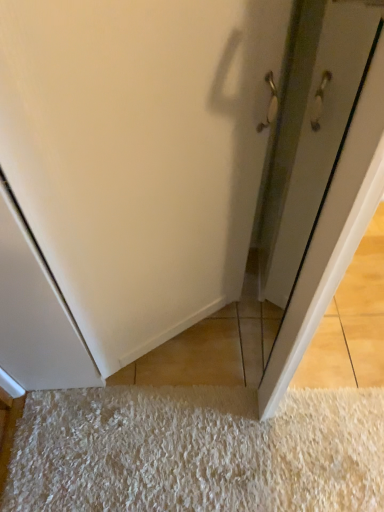
Question: Should I look upward or downward to see white glossy door at center?

Choices:
 (A) up
 (B) down

Answer: (A)

Question: Are white glossy door at center and white shaggy rug at lower center beside each other?

Choices:
 (A) yes
 (B) no

Answer: (B)

Question: Is white glossy door at center oriented away from white shaggy rug at lower center?

Choices:
 (A) no
 (B) yes

Answer: (A)

Question: Can you confirm if white glossy door at center is bigger than white shaggy rug at lower center?

Choices:
 (A) no
 (B) yes

Answer: (B)

Question: Does white glossy door at center have a greater height compared to white shaggy rug at lower center?

Choices:
 (A) no
 (B) yes

Answer: (B)

Question: Considering the relative sizes of white glossy door at center and white shaggy rug at lower center in the image provided, is white glossy door at center thinner than white shaggy rug at lower center?

Choices:
 (A) yes
 (B) no

Answer: (A)

Question: Considering the relative sizes of white glossy door at center and white shaggy rug at lower center in the image provided, is white glossy door at center shorter than white shaggy rug at lower center?

Choices:
 (A) no
 (B) yes

Answer: (A)

Question: From a real-world perspective, is white shaggy rug at lower center physically below white glossy door at center?

Choices:
 (A) no
 (B) yes

Answer: (B)

Question: Does white shaggy rug at lower center have a smaller size compared to white glossy door at center?

Choices:
 (A) yes
 (B) no

Answer: (A)

Question: Considering the relative positions of white shaggy rug at lower center and white glossy door at center in the image provided, is white shaggy rug at lower center behind white glossy door at center?

Choices:
 (A) yes
 (B) no

Answer: (A)

Question: Is white shaggy rug at lower center wider than white glossy door at center?

Choices:
 (A) yes
 (B) no

Answer: (A)

Question: Is white glossy door at center at the back of white shaggy rug at lower center?

Choices:
 (A) no
 (B) yes

Answer: (A)

Question: From the image's perspective, is white shaggy rug at lower center under white glossy door at center?

Choices:
 (A) yes
 (B) no

Answer: (A)

Question: Looking at their shapes, would you say white glossy door at center is wider or thinner than white shaggy rug at lower center?

Choices:
 (A) thin
 (B) wide

Answer: (A)